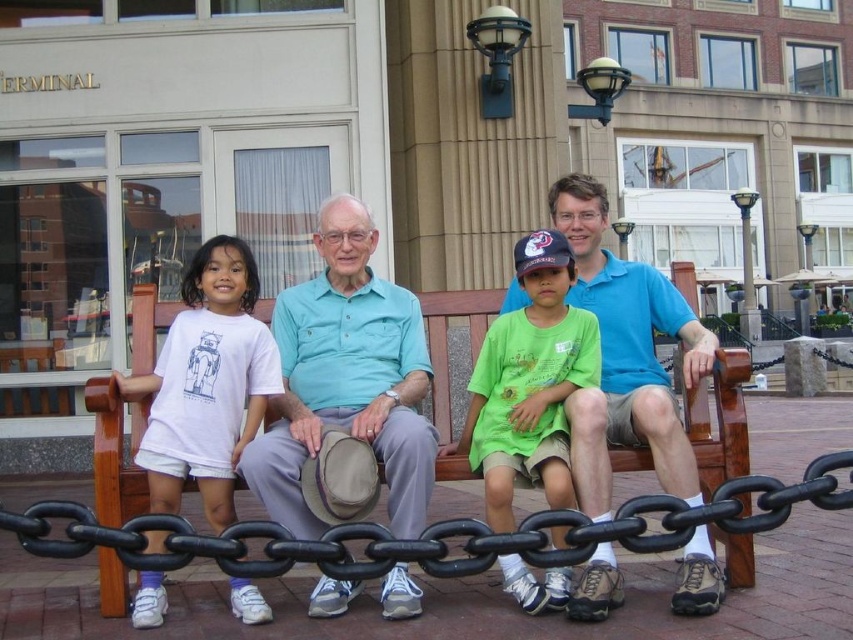
Is white cotton shirt at left bigger than green cotton shirt at center?

No.

Is the position of white cotton shirt at left less distant than that of green cotton shirt at center?

No, white cotton shirt at left is further to the viewer.

Does point (164, 595) come in front of point (489, 413)?

Yes, point (164, 595) is in front of point (489, 413).

I want to click on white cotton shirt at left, so click(x=207, y=384).

Between matte blue shirt at center and light blue cotton shirt at center, which one is positioned lower?

Positioned lower is light blue cotton shirt at center.

Does point (561, 205) come behind point (341, 609)?

Yes, point (561, 205) is farther from viewer.

Locate an element on the screen. matte blue shirt at center is located at coordinates (625, 356).

Does light blue cotton shirt at center appear over blue cotton shirt at center?

Incorrect, light blue cotton shirt at center is not positioned above blue cotton shirt at center.

Can you confirm if light blue cotton shirt at center is bigger than blue cotton shirt at center?

Actually, light blue cotton shirt at center might be smaller than blue cotton shirt at center.

Is point (335, 358) positioned after point (683, 435)?

Yes, point (335, 358) is behind point (683, 435).

At what (x,y) coordinates should I click in order to perform the action: click on light blue cotton shirt at center. Please return your answer as a coordinate pair (x, y). The height and width of the screenshot is (640, 853). Looking at the image, I should click on point(346,378).